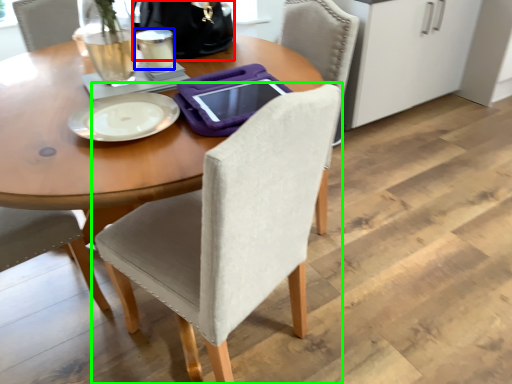
Question: Estimate the real-world distances between objects in this image. Which object is closer to handbag (highlighted by a red box), coffee cup (highlighted by a blue box) or chair (highlighted by a green box)?

Choices:
 (A) coffee cup
 (B) chair

Answer: (A)